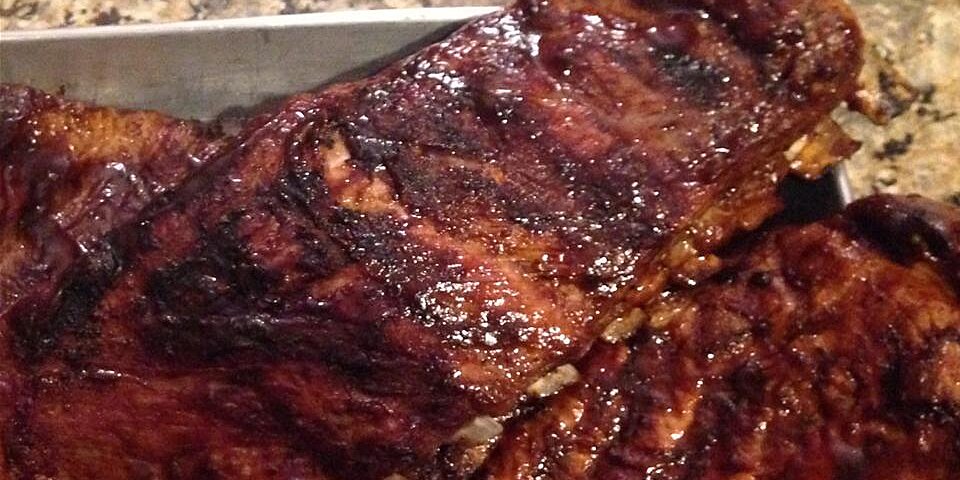
I want to click on granite countertop, so [x=900, y=148].